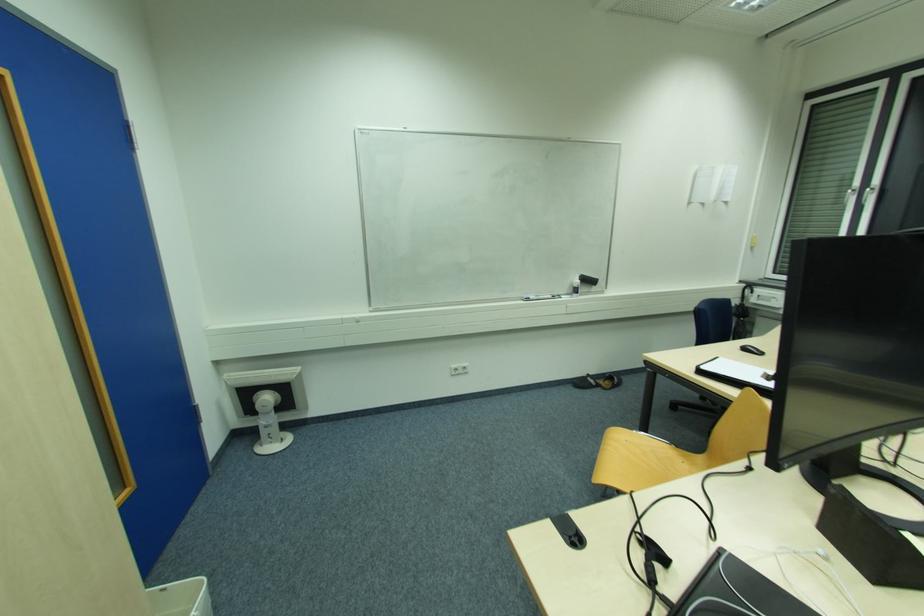
Find the location of a particular element. white trash can is located at coordinates (180, 598).